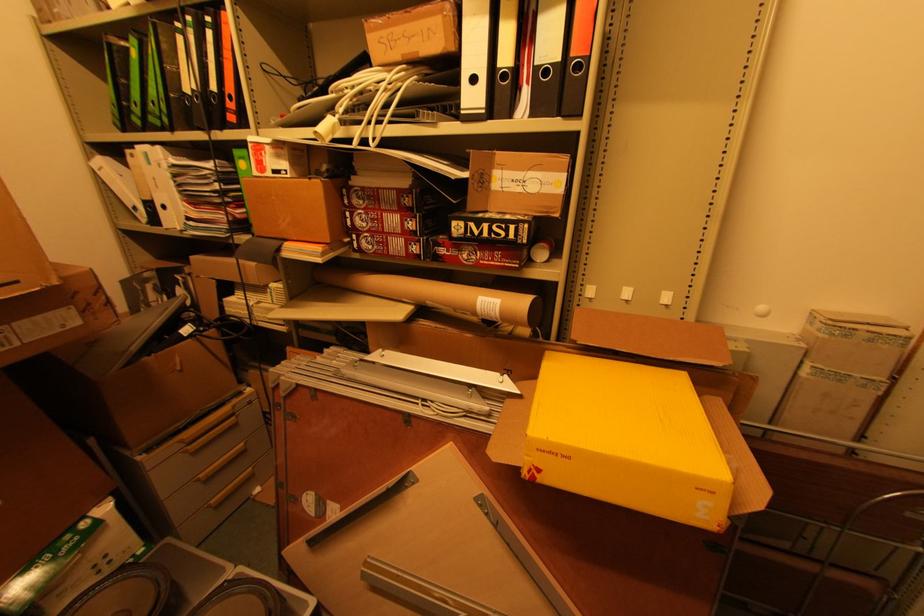
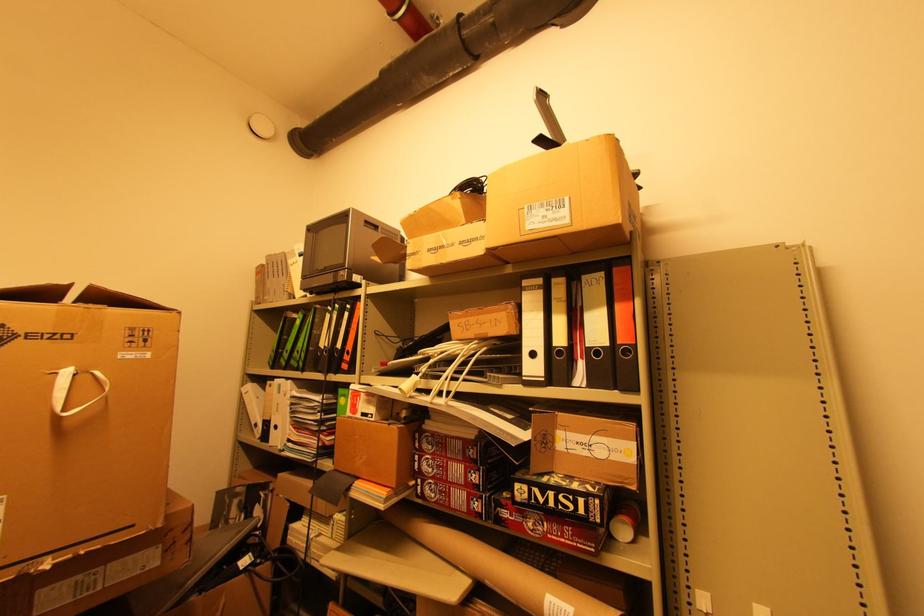
In the second image, find the point that corresponds to (531,257) in the first image.

(611, 535)